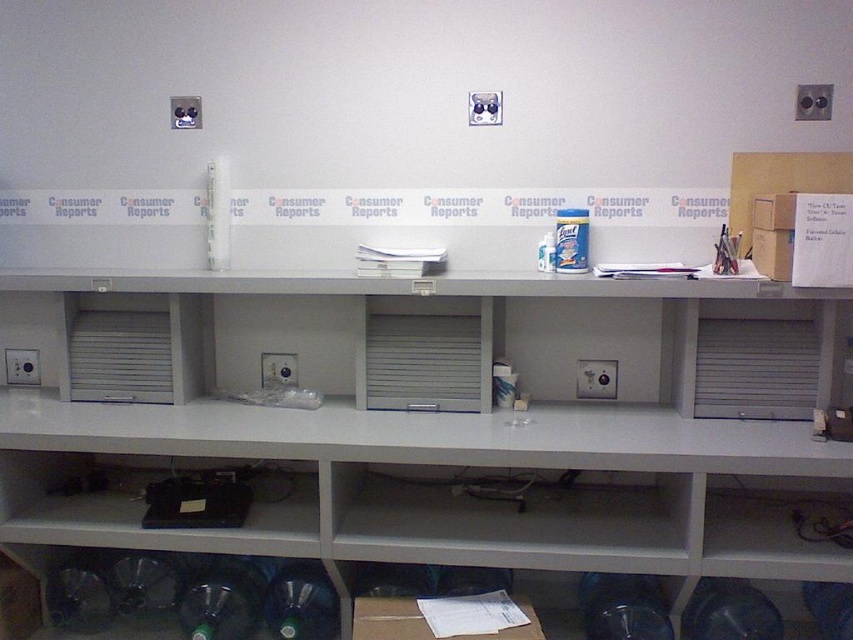
Question: Does white matte shelf at lower center appear on the right side of black plastic shelf at lower left?

Choices:
 (A) yes
 (B) no

Answer: (A)

Question: Is black plastic shelf at lower left positioned at the back of white matte counter top at upper center?

Choices:
 (A) no
 (B) yes

Answer: (B)

Question: Can you confirm if white matte shelf at lower center is bigger than green matte bottle at lower left?

Choices:
 (A) no
 (B) yes

Answer: (B)

Question: Which of the following is the farthest from the observer?

Choices:
 (A) white plastic vent at center
 (B) white matte counter top at upper center
 (C) black plastic shelf at lower left

Answer: (A)

Question: Which point is farther from the camera taking this photo?

Choices:
 (A) (131, 312)
 (B) (782, 484)
 (C) (114, 499)

Answer: (A)

Question: Which point is closer to the camera?

Choices:
 (A) (299, 625)
 (B) (646, 458)
 (C) (819, 289)
 (D) (685, 541)

Answer: (B)